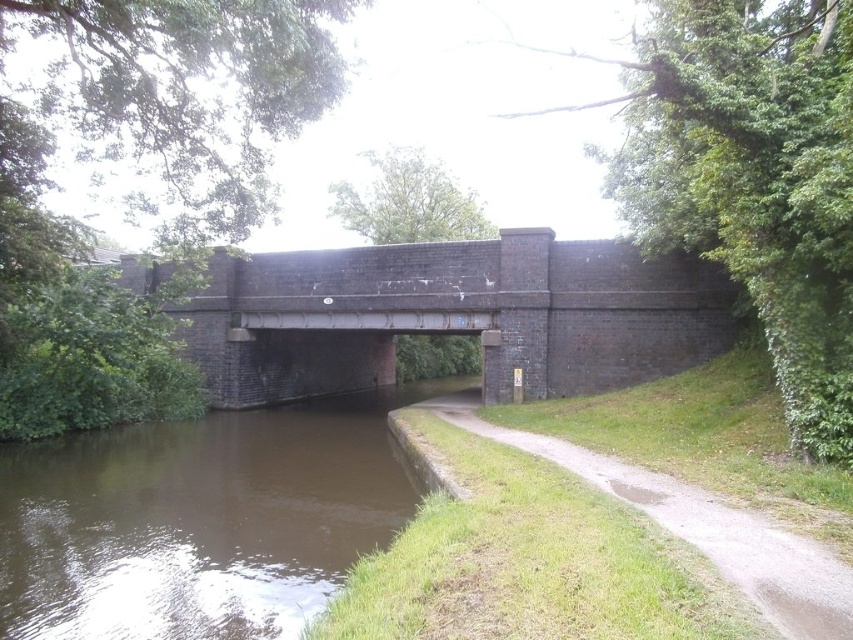
Is brown brick bridge at center smaller than green grassy path at lower center?

No.

Is brown brick bridge at center thinner than green grassy path at lower center?

In fact, brown brick bridge at center might be wider than green grassy path at lower center.

Describe the element at coordinates (453, 316) in the screenshot. I see `brown brick bridge at center` at that location.

Find the location of a particular element. brown brick bridge at center is located at coordinates (453, 316).

Does brown murky water at lower left appear on the right side of green grassy path at lower center?

In fact, brown murky water at lower left is to the left of green grassy path at lower center.

This screenshot has height=640, width=853. I want to click on brown murky water at lower left, so click(200, 518).

Is point (274, 561) positioned before point (721, 348)?

Yes, point (274, 561) is closer to viewer.

Who is positioned more to the left, brown murky water at lower left or brown brick bridge at center?

brown murky water at lower left

Between point (219, 566) and point (480, 307), which one is positioned behind?

Point (480, 307)

Find the location of a particular element. brown murky water at lower left is located at coordinates pyautogui.click(x=200, y=518).